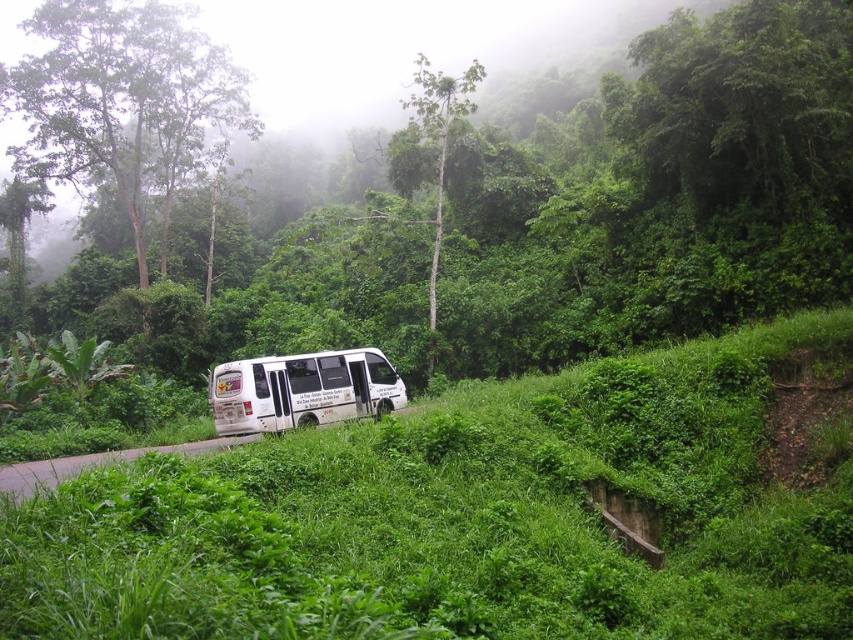
You are driving a large truck that is 3 meters wide. You come across a narrow road with a green leafy tree at center and a white matte van at center parked on it. Can your truck pass through the space between them?

The green leafy tree at center is further to the viewer than the white matte van at center, meaning the van is closer to you. Since the van is parked on the road, there might not be enough space between the tree and the van for your 3 meter wide truck to pass safely. You should check the available space before attempting to drive through.

You are a delivery driver who needs to park your vehicle on the narrow road in the forest. The white matte van at center is already parked there. Can you safely park your vehicle behind it without blocking the road?

The white matte van at center is positioned at coordinates (300, 390), but without knowing the exact dimensions of the road and the space behind the van, it is impossible to determine if parking behind it would block the road. Please check the available space before proceeding.

Looking at this image, you are a hiker standing at the bottom of the slope with the grassy slope and the small concrete retaining wall. You want to take a photo of the green leafy tree at upper left. In which direction should you point your camera to capture it in the frame?

The green leafy tree at upper left is located at point [122,104] in the 2D image, so you should point your camera towards the upper left direction to capture it in the frame.